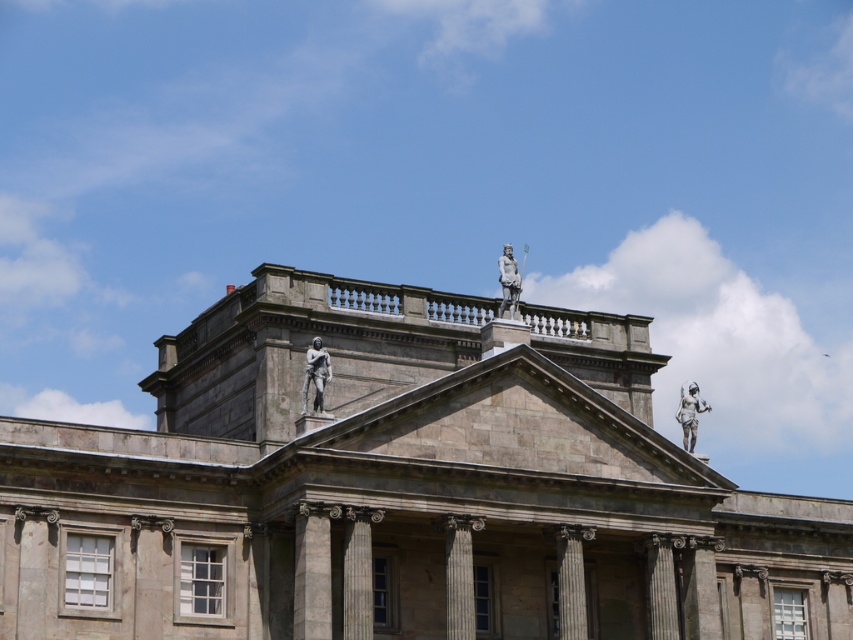
Which is below, gray stone statue at center or polished bronze statue at upper right?

Positioned lower is polished bronze statue at upper right.

Does gray stone statue at center have a greater height compared to polished bronze statue at upper right?

No.

The height and width of the screenshot is (640, 853). What do you see at coordinates (315, 374) in the screenshot? I see `gray stone statue at center` at bounding box center [315, 374].

You are a GUI agent. You are given a task and a screenshot of the screen. Output one action in this format:
    pyautogui.click(x=<x>, y=<y>)
    Task: Click on the gray stone statue at center
    This screenshot has height=640, width=853.
    Given the screenshot: What is the action you would take?
    pyautogui.click(x=315, y=374)

Is point (688, 388) farther from viewer compared to point (508, 253)?

Yes.

Between point (689, 419) and point (508, 273), which one is positioned behind?

Point (689, 419)

Locate an element on the screen. polished bronze statue at upper right is located at coordinates 689,412.

Describe the element at coordinates (315, 374) in the screenshot. I see `gray stone statue at center` at that location.

Does gray stone statue at center have a lesser height compared to polished bronze statue at upper center?

Indeed, gray stone statue at center has a lesser height compared to polished bronze statue at upper center.

This screenshot has width=853, height=640. Describe the element at coordinates (315, 374) in the screenshot. I see `gray stone statue at center` at that location.

Find the location of `gray stone statue at center`. gray stone statue at center is located at coordinates (315, 374).